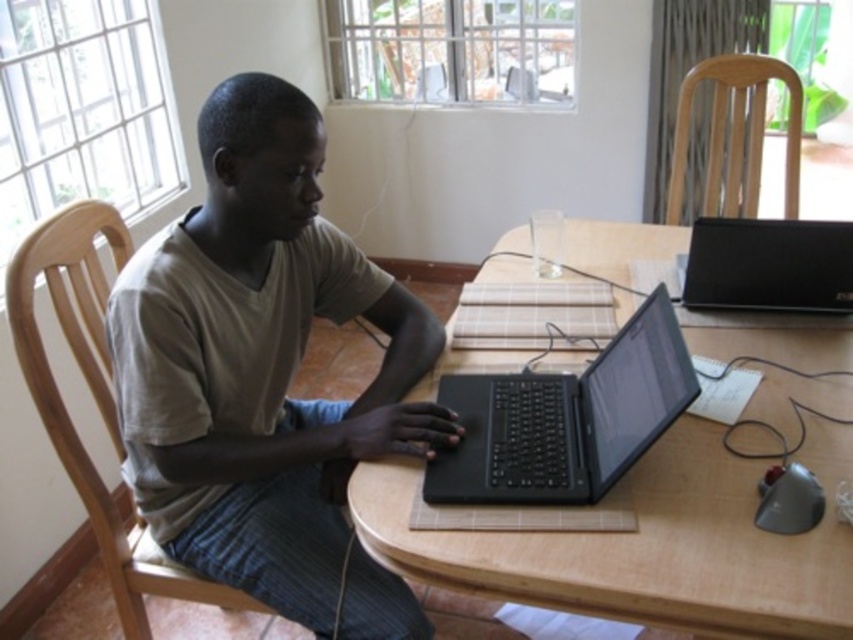
Is light beige cotton shirt at center to the left of black plastic speaker at upper right from the viewer's perspective?

Indeed, light beige cotton shirt at center is positioned on the left side of black plastic speaker at upper right.

In the scene shown: Does light beige cotton shirt at center have a greater width compared to black plastic speaker at upper right?

Yes.

Who is more distant from viewer, (138, 445) or (843, 298)?

Point (843, 298)

Locate an element on the screen. light beige cotton shirt at center is located at coordinates (259, 362).

Looking at this image, does wooden table at center have a greater width compared to black matte laptop at center?

Indeed, wooden table at center has a greater width compared to black matte laptop at center.

Which is behind, point (677, 502) or point (491, 500)?

Point (491, 500)

I want to click on wooden table at center, so click(x=645, y=545).

Measure the distance from wooden table at center to black plastic speaker at upper right.

7.84 inches

Where is `wooden table at center`? wooden table at center is located at coordinates (645, 545).

Does point (598, 604) lie in front of point (846, 301)?

Yes, it is in front of point (846, 301).

At what (x,y) coordinates should I click in order to perform the action: click on wooden table at center. Please return your answer as a coordinate pair (x, y). Looking at the image, I should click on (645, 545).